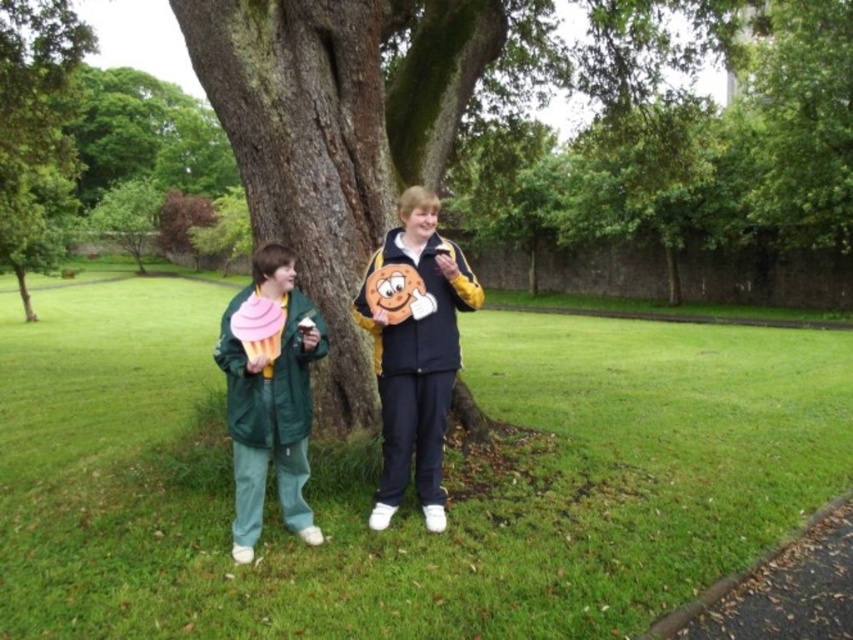
Question: Is green grass at center behind matte yellow jacket at center?

Choices:
 (A) yes
 (B) no

Answer: (B)

Question: Which point is closer to the camera?

Choices:
 (A) green matte jacket at left
 (B) green grass at center
 (C) green leafy tree at center

Answer: (B)

Question: Can you confirm if green grass at center is thinner than matte yellow jacket at center?

Choices:
 (A) no
 (B) yes

Answer: (A)

Question: Does green grass at center lie behind green leafy tree at center?

Choices:
 (A) yes
 (B) no

Answer: (B)

Question: Which is farther from the green leafy tree at center?

Choices:
 (A) green grass at center
 (B) green matte jacket at left
 (C) matte yellow jacket at center

Answer: (B)

Question: Among these points, which one is nearest to the camera?

Choices:
 (A) (544, 502)
 (B) (28, 205)
 (C) (427, 332)

Answer: (C)